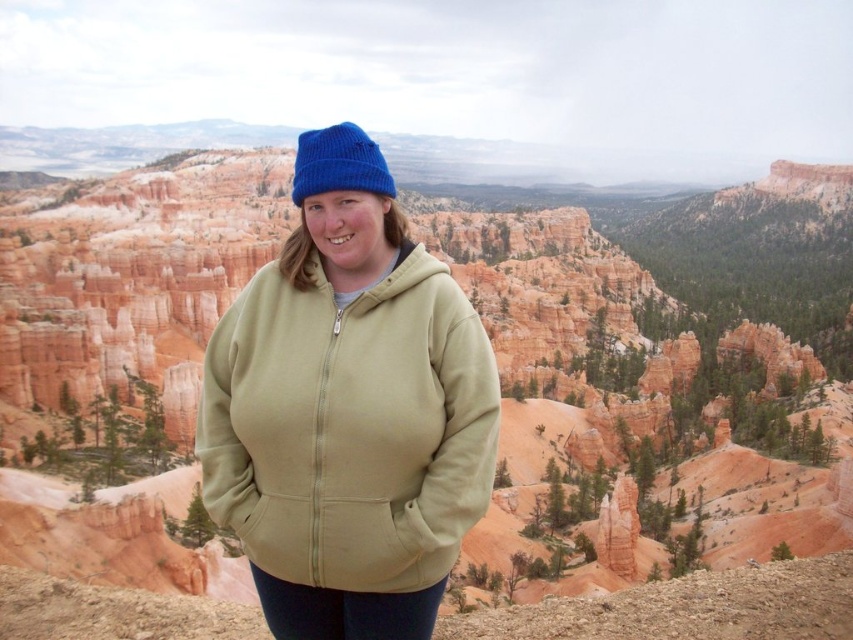
Question: Which point is closer to the camera taking this photo?

Choices:
 (A) (294, 300)
 (B) (375, 189)

Answer: (B)

Question: Does sage green fleece jacket at center appear over blue knitted beanie at upper center?

Choices:
 (A) no
 (B) yes

Answer: (A)

Question: Which object appears farthest from the camera in this image?

Choices:
 (A) blue knitted beanie at upper center
 (B) sage green fleece jacket at center

Answer: (A)

Question: Observing the image, what is the correct spatial positioning of sage green fleece jacket at center in reference to blue knitted beanie at upper center?

Choices:
 (A) below
 (B) above

Answer: (A)

Question: Is sage green fleece jacket at center above blue knitted beanie at upper center?

Choices:
 (A) no
 (B) yes

Answer: (A)

Question: Which of the following is the closest to the observer?

Choices:
 (A) blue knitted beanie at upper center
 (B) sage green fleece jacket at center

Answer: (B)